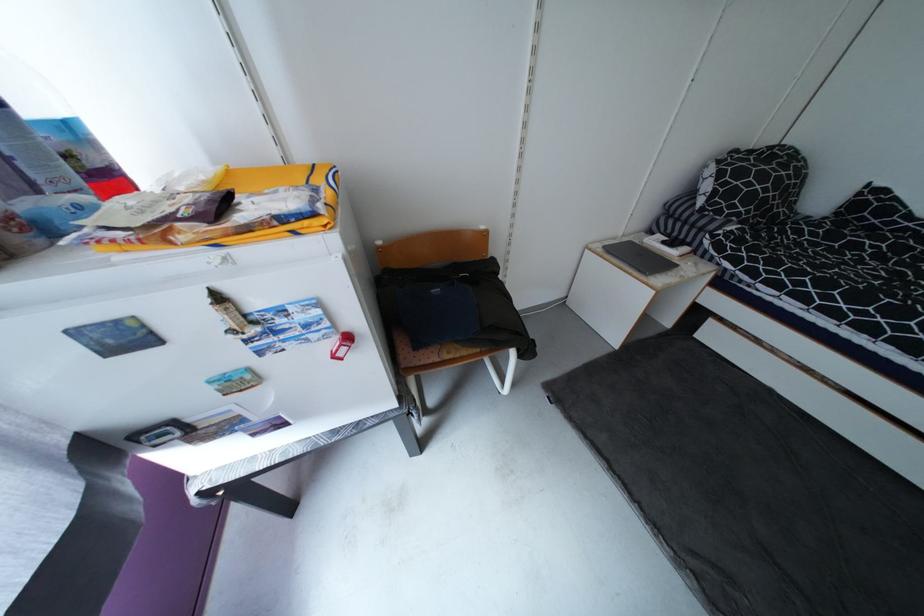
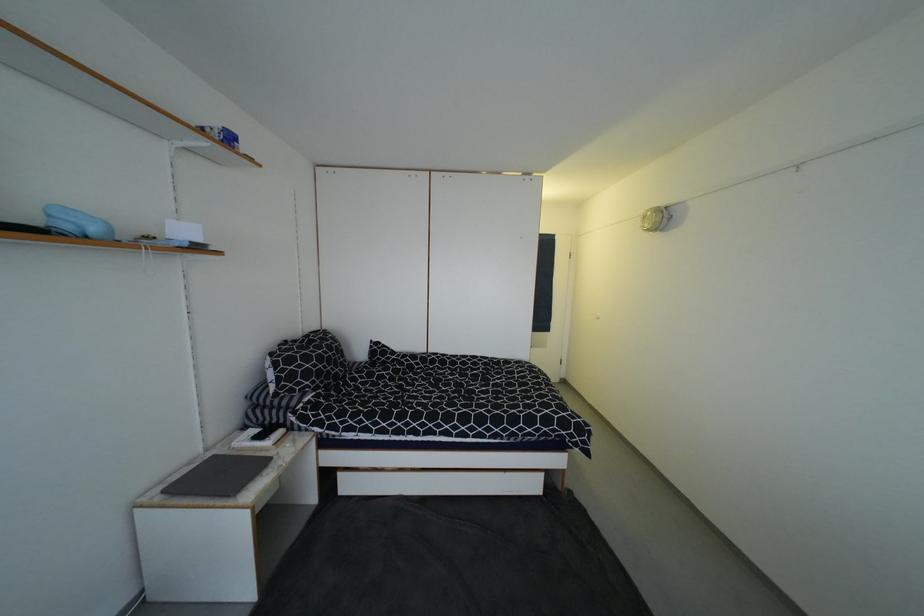
Question: The camera is either moving clockwise (left) or counter-clockwise (right) around the object. The first image is from the beginning of the video and the second image is from the end. Is the camera moving left or right when shooting the video?

Choices:
 (A) Left
 (B) Right

Answer: (A)